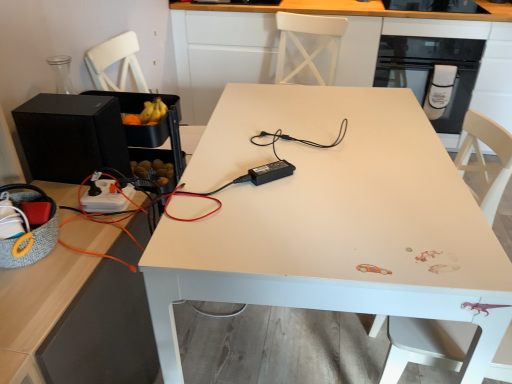
The image size is (512, 384). What do you see at coordinates (339, 52) in the screenshot? I see `white matte table at center` at bounding box center [339, 52].

Locate an element on the screen. The width and height of the screenshot is (512, 384). white matte table at center is located at coordinates (339, 52).

Describe the element at coordinates (430, 71) in the screenshot. I see `black glass door at upper right` at that location.

What do you see at coordinates (71, 136) in the screenshot? I see `black matte speaker at left, placed as the second appliance when sorted from right to left` at bounding box center [71, 136].

Measure the distance between point [108,164] and camera.

Point [108,164] is 4.45 feet from camera.

Identify the location of white wood swivel chair at lower right. The width and height of the screenshot is (512, 384). (425, 344).

Locate an element on the screen. This screenshot has width=512, height=384. white matte table at center is located at coordinates (331, 220).

Where is `white matte table at center`? This screenshot has width=512, height=384. white matte table at center is located at coordinates (339, 52).

Is white wood swivel chair at lower right directly adjacent to white matte table at center?

No, white wood swivel chair at lower right is not touching white matte table at center.

How different are the orientations of white wood swivel chair at lower right and white matte table at center in degrees?

white wood swivel chair at lower right and white matte table at center are facing 168 degrees away from each other.

Is white wood swivel chair at lower right facing towards white matte table at center?

Yes, white wood swivel chair at lower right is turned towards white matte table at center.

Does white wood swivel chair at lower right lie behind white matte table at center?

That is False.

Which is in front, point (57, 109) or point (270, 44)?

Positioned in front is point (57, 109).

Locate an element on the screen. This screenshot has width=512, height=384. appliance that is the 1st one above the white matte table at center (from a real-world perspective) is located at coordinates (71, 136).

How different are the orientations of black matte speaker at left, which is the first appliance in back-to-front order, and white matte table at center in degrees?

There is a 90.8-degree angle between the facing directions of black matte speaker at left, which is the first appliance in back-to-front order, and white matte table at center.

From a real-world perspective, is black matte speaker at left, arranged as the 2th appliance when viewed from the front, on top of white matte table at center?

Correct, in the physical world, black matte speaker at left, arranged as the 2th appliance when viewed from the front, is higher than white matte table at center.

Which is in front, point (269, 177) or point (410, 85)?

The point (269, 177) is in front.

Is black plastic power adapter at center, the 2th appliance from the left, completely or partially outside of black glass door at upper right?

Yes, black plastic power adapter at center, the 2th appliance from the left, is not within black glass door at upper right.

From a real-world perspective, is black plastic power adapter at center, the 2th appliance viewed from the back, on black glass door at upper right?

Yes, from a real-world perspective, black plastic power adapter at center, the 2th appliance viewed from the back, is over black glass door at upper right

Is white matte table at center not inside white wood swivel chair at lower right?

white matte table at center is positioned outside white wood swivel chair at lower right.

Is white matte table at center beside white wood swivel chair at lower right?

No, white matte table at center is not in contact with white wood swivel chair at lower right.

From the image's perspective, is white matte table at center located beneath white wood swivel chair at lower right?

Actually, white matte table at center appears above white wood swivel chair at lower right in the image.

Find the location of a particular element. The image size is (512, 384). table beneath the white wood swivel chair at lower right (from a real-world perspective) is located at coordinates (331, 220).

Is black glass door at upper right further to camera compared to white wood swivel chair at lower right?

Yes, it is.

Considering the sizes of objects black glass door at upper right and white wood swivel chair at lower right in the image provided, who is bigger, black glass door at upper right or white wood swivel chair at lower right?

black glass door at upper right is bigger.

Locate an element on the screen. dish washer above the white wood swivel chair at lower right (from a real-world perspective) is located at coordinates (430, 71).

Is white wood swivel chair at lower right completely or partially outside of white matte table at center?

Indeed, white wood swivel chair at lower right is completely outside white matte table at center.

Locate an element on the screen. swivel chair below the white matte table at center (from the image's perspective) is located at coordinates (425, 344).

Find the location of `appliance that is the 1st one when counting upward from the white matte table at center (from the image's perspective)`. appliance that is the 1st one when counting upward from the white matte table at center (from the image's perspective) is located at coordinates (270, 172).

Is white matte table at center bigger than black plastic power adapter at center, the 2th appliance viewed from the back?

Yes.

Between white matte table at center and black plastic power adapter at center, positioned as the first appliance in front-to-back order, which one has smaller width?

Thinner between the two is black plastic power adapter at center, positioned as the first appliance in front-to-back order.

Based on their positions, is white matte table at center located to the left or right of black plastic power adapter at center, the 2th appliance viewed from the back?

In the image, white matte table at center appears on the right side of black plastic power adapter at center, the 2th appliance viewed from the back.

Where is `table that appears on the left of white wood swivel chair at lower right`? This screenshot has width=512, height=384. table that appears on the left of white wood swivel chair at lower right is located at coordinates (331, 220).

Find the location of a particular element. This screenshot has height=384, width=512. cabinetry above the black matte speaker at left, placed as the second appliance when sorted from right to left (from the image's perspective) is located at coordinates (339, 52).

Looking at the image, which one is located further to black matte speaker at left, which is the first appliance in back-to-front order, white matte table at center or white matte table at center?

white matte table at center is further to black matte speaker at left, which is the first appliance in back-to-front order.

Looking at the image, which one is located further to black glass door at upper right, black matte speaker at left, which ranks as the first appliance in left-to-right order, or white matte table at center?

The object further to black glass door at upper right is black matte speaker at left, which ranks as the first appliance in left-to-right order.

Estimate the real-world distances between objects in this image. Which object is further from black plastic power adapter at center, the 2th appliance viewed from the back, black matte speaker at left, which is the first appliance in back-to-front order, or white matte table at center?

Based on the image, black matte speaker at left, which is the first appliance in back-to-front order, appears to be further to black plastic power adapter at center, the 2th appliance viewed from the back.

From the image, which object appears to be nearer to black glass door at upper right, black matte speaker at left, placed as the second appliance when sorted from right to left, or white wood swivel chair at lower right?

white wood swivel chair at lower right is closer to black glass door at upper right.

Based on their spatial positions, is white matte table at center or white matte table at center further from white wood swivel chair at lower right?

white matte table at center is further to white wood swivel chair at lower right.

When comparing their distances from black plastic power adapter at center, the 2th appliance from the left, does white wood swivel chair at lower right or white matte table at center seem closer?

Based on the image, white wood swivel chair at lower right appears to be nearer to black plastic power adapter at center, the 2th appliance from the left.

From the image, which object appears to be farther from white matte table at center, black plastic power adapter at center, placed as the 1th appliance when sorted from right to left, or black glass door at upper right?

Among the two, black plastic power adapter at center, placed as the 1th appliance when sorted from right to left, is located further to white matte table at center.

From the image, which object appears to be farther from white matte table at center, white wood swivel chair at lower right or black glass door at upper right?

white wood swivel chair at lower right is positioned further to the anchor white matte table at center.

You are a GUI agent. You are given a task and a screenshot of the screen. Output one action in this format:
    pyautogui.click(x=<x>, y=<y>)
    Task: Click on the cabinetry between white wood swivel chair at lower right and black glass door at upper right in the front-back direction
    
    Given the screenshot: What is the action you would take?
    pyautogui.click(x=339, y=52)

Where is `table between black plastic power adapter at center, positioned as the first appliance in front-to-back order, and white wood swivel chair at lower right`? table between black plastic power adapter at center, positioned as the first appliance in front-to-back order, and white wood swivel chair at lower right is located at coordinates (331, 220).

Identify the location of appliance between black matte speaker at left, which is the first appliance in back-to-front order, and white matte table at center, in the horizontal direction. (270, 172).

This screenshot has width=512, height=384. In order to click on table between white wood swivel chair at lower right and white matte table at center from front to back in this screenshot , I will do `click(331, 220)`.